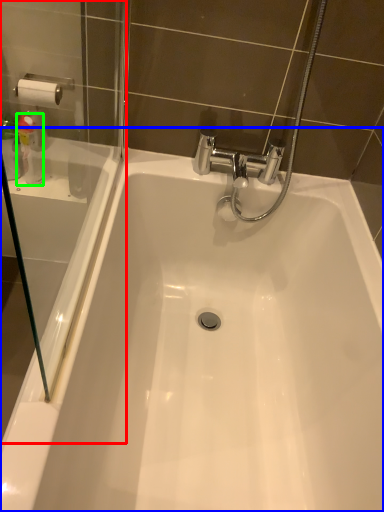
Question: Based on their relative distances, which object is farther from screen door (highlighted by a red box)? Choose from bathtub (highlighted by a blue box) and cleaning product (highlighted by a green box).

Choices:
 (A) bathtub
 (B) cleaning product

Answer: (A)